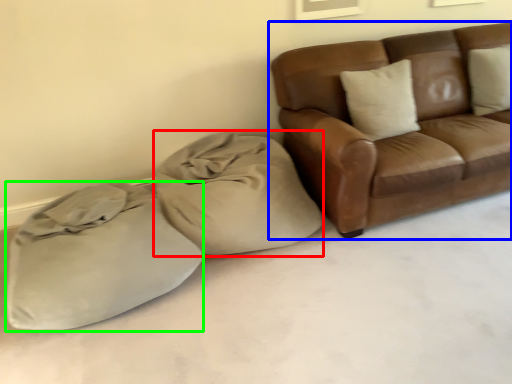
Question: Which is farther away from bean bag chair (highlighted by a red box)? studio couch (highlighted by a blue box) or sack (highlighted by a green box)?

Choices:
 (A) studio couch
 (B) sack

Answer: (A)